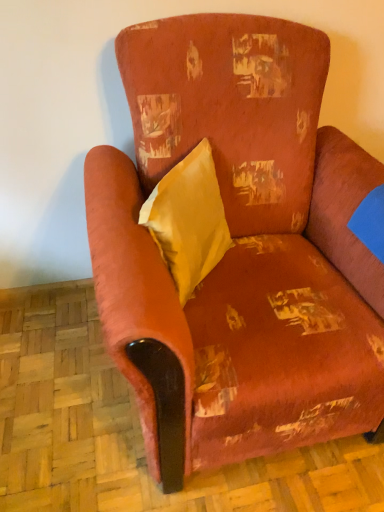
Question: Considering the relative positions of yellow fabric pillow at center and distressed velvet armchair at center in the image provided, is yellow fabric pillow at center to the right of distressed velvet armchair at center from the viewer's perspective?

Choices:
 (A) yes
 (B) no

Answer: (B)

Question: Considering the relative sizes of yellow fabric pillow at center and distressed velvet armchair at center in the image provided, is yellow fabric pillow at center taller than distressed velvet armchair at center?

Choices:
 (A) yes
 (B) no

Answer: (B)

Question: Considering the relative positions of yellow fabric pillow at center and distressed velvet armchair at center in the image provided, is yellow fabric pillow at center behind distressed velvet armchair at center?

Choices:
 (A) no
 (B) yes

Answer: (B)

Question: Considering the relative sizes of yellow fabric pillow at center and distressed velvet armchair at center in the image provided, is yellow fabric pillow at center smaller than distressed velvet armchair at center?

Choices:
 (A) no
 (B) yes

Answer: (B)

Question: Is yellow fabric pillow at center aimed at distressed velvet armchair at center?

Choices:
 (A) no
 (B) yes

Answer: (B)

Question: Is yellow fabric pillow at center thinner than distressed velvet armchair at center?

Choices:
 (A) yes
 (B) no

Answer: (A)

Question: Can you see distressed velvet armchair at center touching yellow fabric pillow at center?

Choices:
 (A) yes
 (B) no

Answer: (B)

Question: Is distressed velvet armchair at center facing away from yellow fabric pillow at center?

Choices:
 (A) no
 (B) yes

Answer: (B)

Question: Is distressed velvet armchair at center far from yellow fabric pillow at center?

Choices:
 (A) no
 (B) yes

Answer: (A)

Question: Could you tell me if distressed velvet armchair at center is turned towards yellow fabric pillow at center?

Choices:
 (A) no
 (B) yes

Answer: (B)

Question: Is distressed velvet armchair at center to the left of yellow fabric pillow at center from the viewer's perspective?

Choices:
 (A) no
 (B) yes

Answer: (A)

Question: Is distressed velvet armchair at center positioned beyond the bounds of yellow fabric pillow at center?

Choices:
 (A) no
 (B) yes

Answer: (B)

Question: Looking at their shapes, would you say distressed velvet armchair at center is wider or thinner than yellow fabric pillow at center?

Choices:
 (A) wide
 (B) thin

Answer: (A)